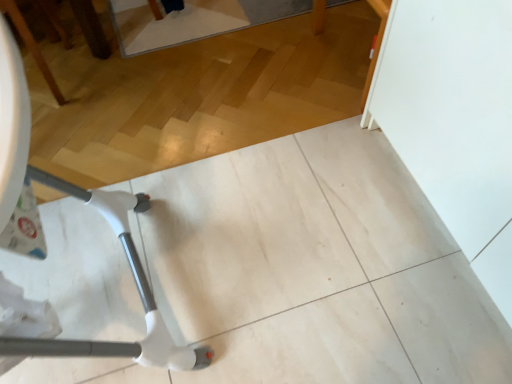
Measure the distance between wooden table at upper left and camera.

wooden table at upper left is 1.64 meters away from camera.

Image resolution: width=512 pixels, height=384 pixels. What are the coordinates of `wooden table at upper left` in the screenshot? It's located at (31, 45).

In order to face wooden table at upper left, should I rotate leftwards or rightwards?

You should rotate left by 29.632 degrees.

This screenshot has width=512, height=384. Describe the element at coordinates (31, 45) in the screenshot. I see `wooden table at upper left` at that location.

Find the location of `wooden table at upper left`. wooden table at upper left is located at coordinates (31, 45).